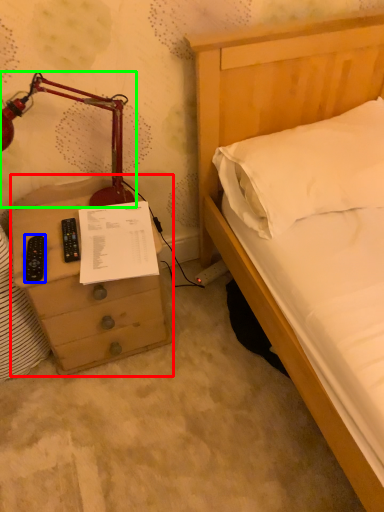
Question: Estimate the real-world distances between objects in this image. Which object is farther from chest of drawers (highlighted by a red box), remote (highlighted by a blue box) or lamp (highlighted by a green box)?

Choices:
 (A) remote
 (B) lamp

Answer: (B)